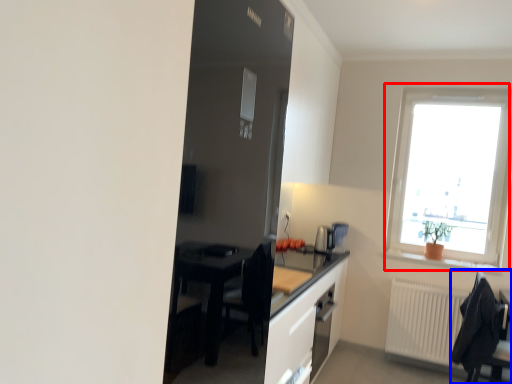
Question: Which object appears closest to the camera in this image, window (highlighted by a red box) or chair (highlighted by a blue box)?

Choices:
 (A) window
 (B) chair

Answer: (B)